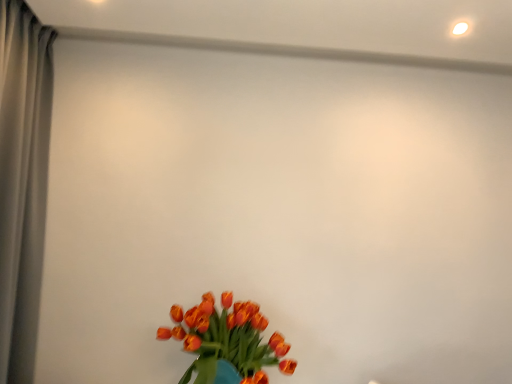
Question: Is point (15, 254) positioned closer to the camera than point (199, 367)?

Choices:
 (A) closer
 (B) farther

Answer: (B)

Question: In terms of width, does gray fabric curtain at left look wider or thinner when compared to orange matte tulips at lower center?

Choices:
 (A) wide
 (B) thin

Answer: (B)

Question: Looking at the image, does gray fabric curtain at left seem bigger or smaller compared to orange matte tulips at lower center?

Choices:
 (A) big
 (B) small

Answer: (A)

Question: In terms of height, does orange matte tulips at lower center look taller or shorter compared to gray fabric curtain at left?

Choices:
 (A) tall
 (B) short

Answer: (B)

Question: From a real-world perspective, is orange matte tulips at lower center physically located above or below gray fabric curtain at left?

Choices:
 (A) above
 (B) below

Answer: (B)

Question: Considering the positions of point (258, 374) and point (6, 135), is point (258, 374) closer or farther from the camera than point (6, 135)?

Choices:
 (A) farther
 (B) closer

Answer: (A)

Question: In the image, is orange matte tulips at lower center positioned in front of or behind gray fabric curtain at left?

Choices:
 (A) front
 (B) behind

Answer: (B)